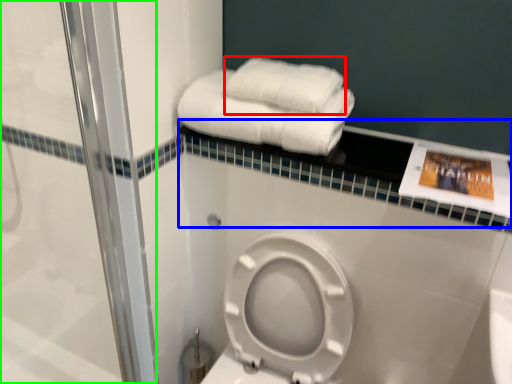
Question: Based on their relative distances, which object is farther from towel (highlighted by a red box)? Choose from balustrade (highlighted by a blue box) and shower door (highlighted by a green box).

Choices:
 (A) balustrade
 (B) shower door

Answer: (B)